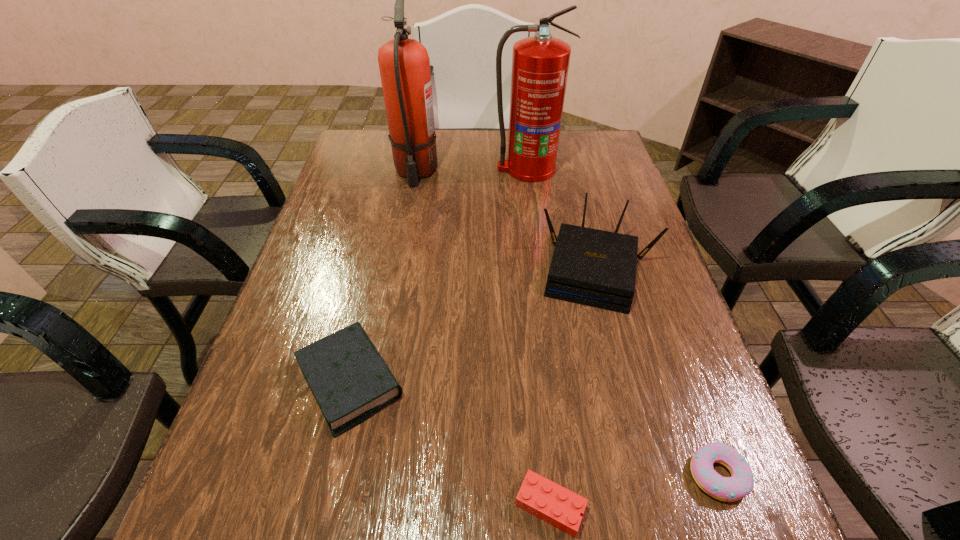
Identify the location of blank space located on the back of the third farthest object. (584, 212).

Locate an element on the screen. Image resolution: width=960 pixels, height=540 pixels. vacant space located 0.080m on the left of the third nearest object is located at coordinates 255,382.

The height and width of the screenshot is (540, 960). Find the location of `vacant area situated 0.400m on the back of the Lego`. vacant area situated 0.400m on the back of the Lego is located at coordinates (529, 300).

You are a GUI agent. You are given a task and a screenshot of the screen. Output one action in this format:
    pyautogui.click(x=<x>, y=<y>)
    Task: Click on the vacant space located 0.160m on the left of the doughnut
    The height and width of the screenshot is (540, 960).
    Given the screenshot: What is the action you would take?
    pyautogui.click(x=595, y=475)

Image resolution: width=960 pixels, height=540 pixels. Find the location of `object that is at the near edge`. object that is at the near edge is located at coordinates (539, 496).

Find the location of `object present at the left edge`. object present at the left edge is located at coordinates (349, 379).

Find the location of a particular element. The width and height of the screenshot is (960, 540). router located in the right edge section of the desktop is located at coordinates (597, 268).

The height and width of the screenshot is (540, 960). What are the coordinates of `doughnut that is at the right edge` in the screenshot? It's located at (729, 489).

This screenshot has width=960, height=540. In order to click on vacant space at the far edge of the desktop in this screenshot , I will do `click(495, 167)`.

Image resolution: width=960 pixels, height=540 pixels. In order to click on vacant area at the left edge of the desktop in this screenshot , I will do `click(354, 180)`.